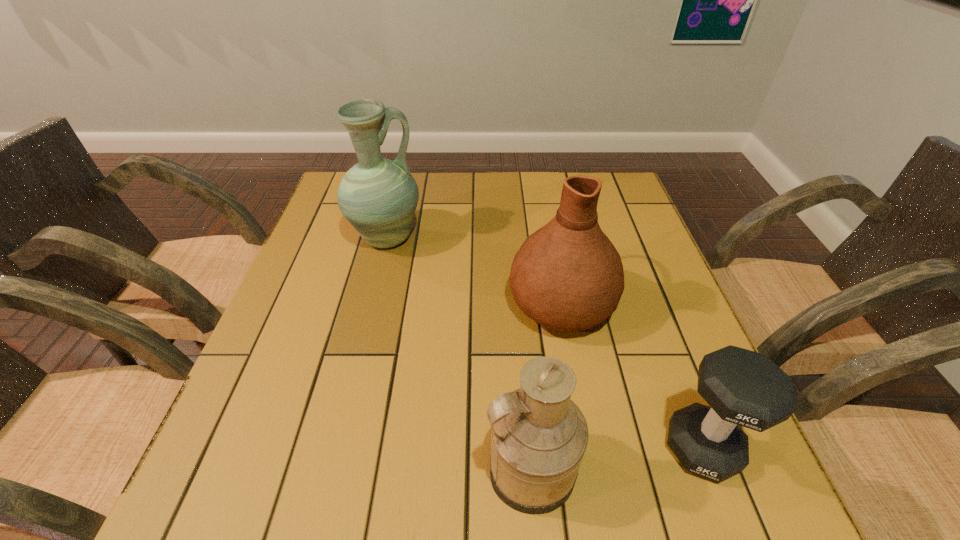
This screenshot has height=540, width=960. Find the location of `free space that satisfies the following two spatial constraints: 1. on the handle side of the farthest object; 2. on the side of the third nearest object with the handle`. free space that satisfies the following two spatial constraints: 1. on the handle side of the farthest object; 2. on the side of the third nearest object with the handle is located at coordinates (371, 302).

Locate an element on the screen. The width and height of the screenshot is (960, 540). free spot that satisfies the following two spatial constraints: 1. on the handle side of the farthest pitcher; 2. on the back side of the dumbbell is located at coordinates (334, 448).

You are a GUI agent. You are given a task and a screenshot of the screen. Output one action in this format:
    pyautogui.click(x=<x>, y=<y>)
    Task: Click on the free point that satisfies the following two spatial constraints: 1. on the handle side of the leftmost object; 2. on the back side of the shortest pitcher
    The width and height of the screenshot is (960, 540).
    Given the screenshot: What is the action you would take?
    pos(328,469)

Image resolution: width=960 pixels, height=540 pixels. I want to click on free space that satisfies the following two spatial constraints: 1. on the handle side of the leftmost object; 2. on the left side of the rightmost object, so click(334, 448).

Locate an element on the screen. This screenshot has width=960, height=540. free location that satisfies the following two spatial constraints: 1. on the handle side of the shortest object; 2. on the right side of the leftmost object is located at coordinates click(334, 448).

At what (x,y) coordinates should I click in order to perform the action: click on vacant point that satisfies the following two spatial constraints: 1. on the handle side of the leftmost object; 2. on the back side of the rightmost object. Please return your answer as a coordinate pair (x, y). Image resolution: width=960 pixels, height=540 pixels. Looking at the image, I should click on (334, 448).